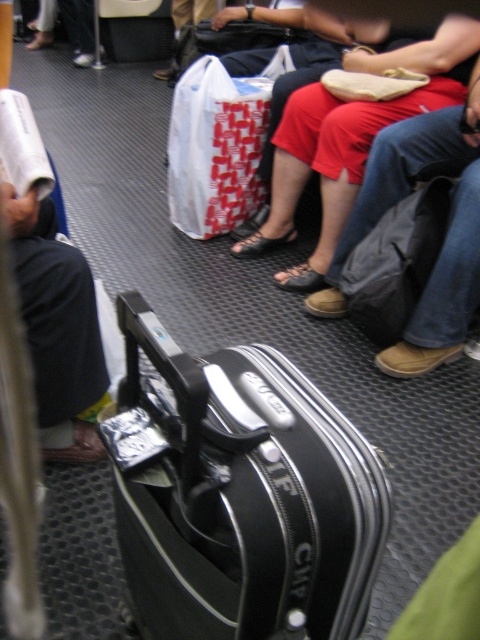
In the scene shown: Between black hard shell suitcase at center and white paper bag at center, which one appears on the left side from the viewer's perspective?

Positioned to the left is white paper bag at center.

Who is more distant from viewer, (287, 547) or (225, 211)?

The point (225, 211) is more distant.

Locate an element on the screen. black hard shell suitcase at center is located at coordinates (239, 493).

Looking at this image, does white paper bag at center appear under dark gray fabric backpack at right?

Actually, white paper bag at center is above dark gray fabric backpack at right.

Between point (177, 147) and point (381, 269), which one is positioned in front?

Point (381, 269) is more forward.

Identify the location of white paper bag at center. (215, 148).

Consider the image. Is black hard shell suitcase at center thinner than dark gray fabric backpack at right?

No, black hard shell suitcase at center is not thinner than dark gray fabric backpack at right.

Does black hard shell suitcase at center have a greater width compared to dark gray fabric backpack at right?

Yes.

Which is behind, point (313, 417) or point (350, 305)?

The point (350, 305) is behind.

Locate an element on the screen. black hard shell suitcase at center is located at coordinates [x=239, y=493].